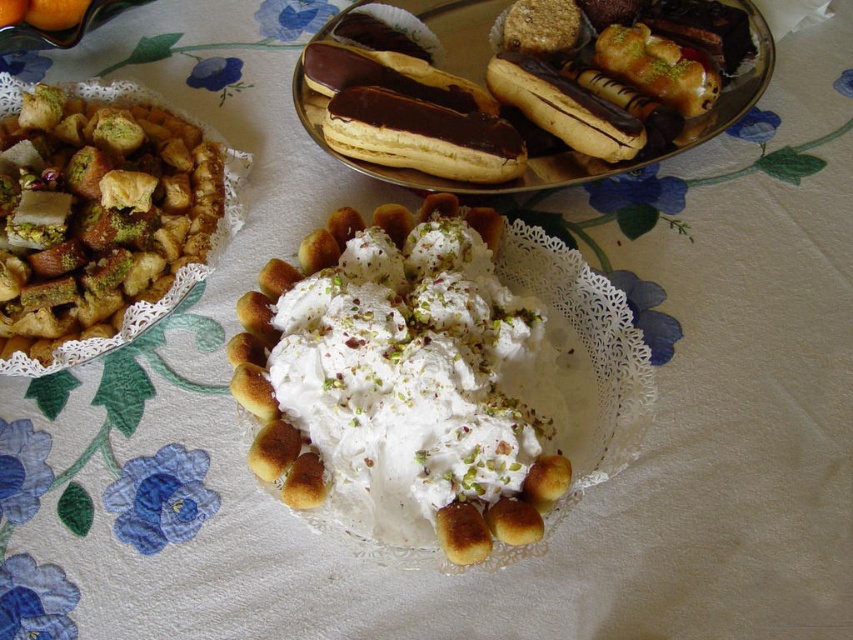
Is chocolate-coated pastry at upper center wider than chocolate-coated pastry at upper right?

Correct, the width of chocolate-coated pastry at upper center exceeds that of chocolate-coated pastry at upper right.

Does chocolate-coated pastry at upper center appear over chocolate-coated pastry at upper right?

No.

The height and width of the screenshot is (640, 853). I want to click on chocolate-coated pastry at upper center, so click(x=422, y=136).

Image resolution: width=853 pixels, height=640 pixels. What are the coordinates of `chocolate-coated pastry at upper center` in the screenshot? It's located at (422, 136).

Is point (270, 432) closer to camera compared to point (460, 506)?

No, it is behind (460, 506).

Is point (248, 324) positioned behind point (482, 531)?

That is True.

Describe the element at coordinates (396, 369) in the screenshot. The height and width of the screenshot is (640, 853). I see `white fluffy dessert at center` at that location.

What are the coordinates of `white fluffy dessert at center` in the screenshot? It's located at (396, 369).

Who is shorter, chocolate-coated pastry at upper right or golden brown pastry at center?

Standing shorter between the two is golden brown pastry at center.

Between point (573, 102) and point (463, 508), which one is positioned behind?

Positioned behind is point (573, 102).

Locate an element on the screen. The width and height of the screenshot is (853, 640). chocolate-coated pastry at upper right is located at coordinates (564, 108).